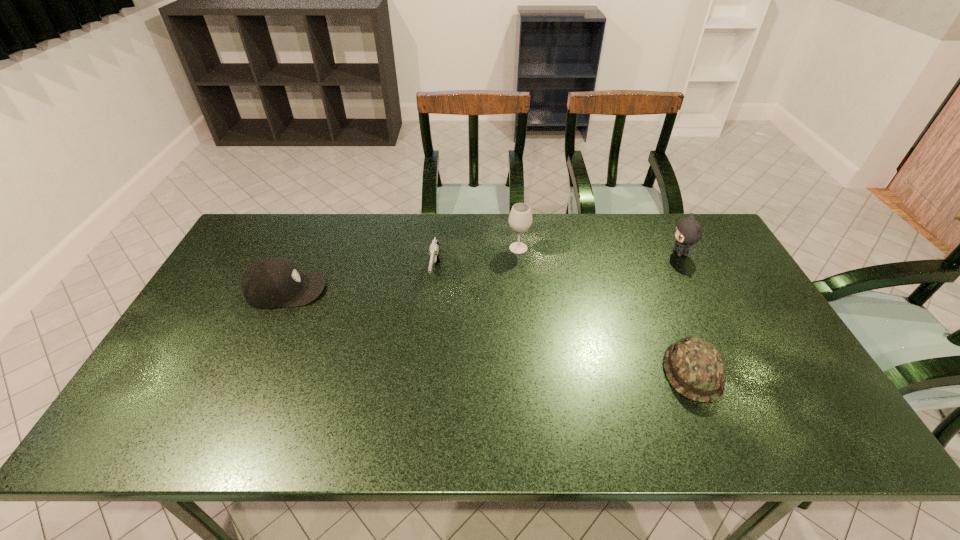
Where is `the third object from right to left`? the third object from right to left is located at coordinates (520, 219).

This screenshot has width=960, height=540. I want to click on the tallest object, so click(x=520, y=219).

I want to click on kitten, so click(688, 231).

Locate an element on the screen. The height and width of the screenshot is (540, 960). the second object from left to right is located at coordinates (434, 250).

This screenshot has width=960, height=540. Identify the location of the taller headwear. (270, 282).

This screenshot has height=540, width=960. What are the coordinates of `the left headwear` in the screenshot? It's located at (270, 282).

Where is `the shorter headwear`? the shorter headwear is located at coordinates (695, 368).

Identify the location of the second object from right to left. This screenshot has height=540, width=960. (695, 368).

Where is `vacant region located 0.390m on the front of the wineglass`? Image resolution: width=960 pixels, height=540 pixels. vacant region located 0.390m on the front of the wineglass is located at coordinates (529, 353).

This screenshot has height=540, width=960. What are the coordinates of `free space located on the front-facing side of the rightmost object` in the screenshot? It's located at (580, 253).